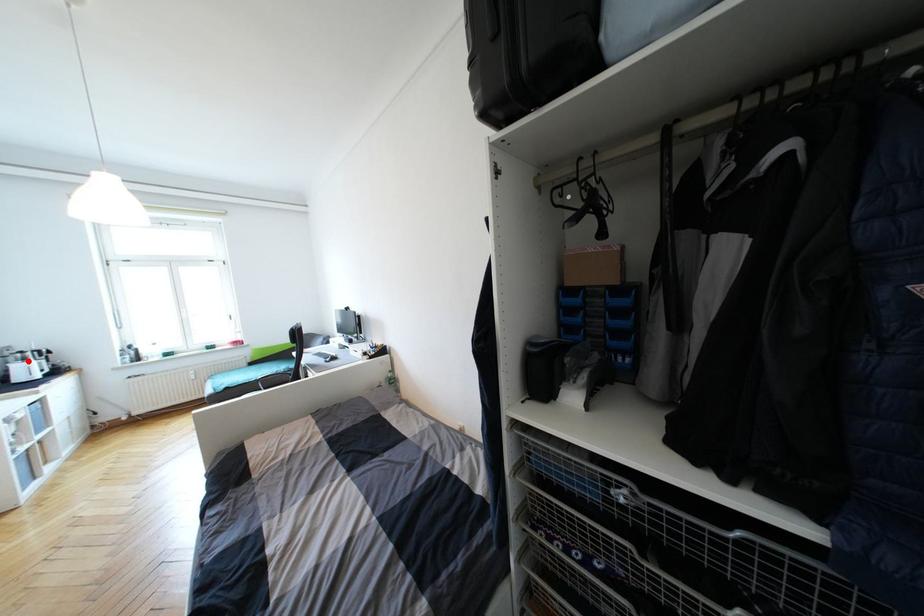
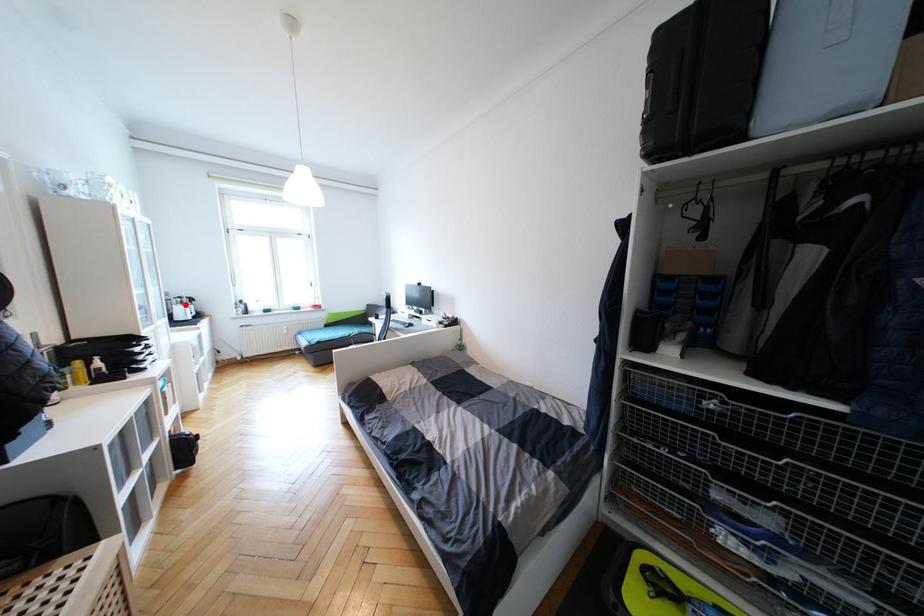
I am providing you with two images of the same scene from different viewpoints. A red point is marked on the first image and another point is marked on the second image. Does the point marked in image1 correspond to the same location as the one in image2?

Yes